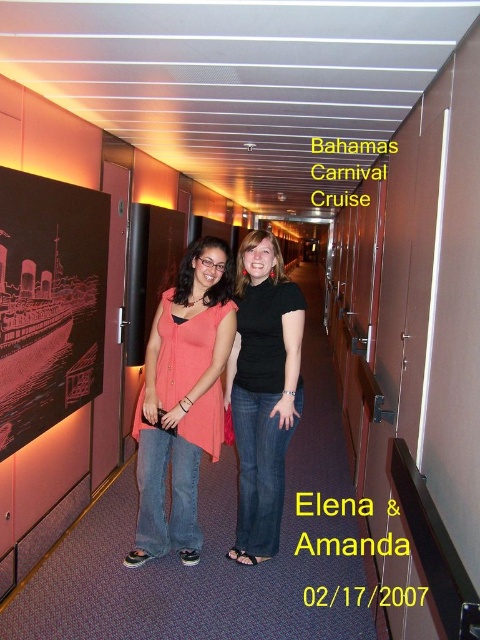
Question: Can you confirm if matte pink top at center is positioned below black matte t-shirt at center?

Choices:
 (A) yes
 (B) no

Answer: (A)

Question: Is the position of matte pink top at center less distant than that of black matte t-shirt at center?

Choices:
 (A) no
 (B) yes

Answer: (B)

Question: Can you confirm if matte pink top at center is thinner than black matte t-shirt at center?

Choices:
 (A) no
 (B) yes

Answer: (A)

Question: Which of the following is the closest to the observer?

Choices:
 (A) (143, 444)
 (B) (264, 481)

Answer: (A)

Question: Which point is closer to the camera?

Choices:
 (A) [x=276, y=547]
 (B) [x=204, y=413]

Answer: (B)

Question: Which point is closer to the camera?

Choices:
 (A) matte pink top at center
 (B) black matte t-shirt at center

Answer: (A)